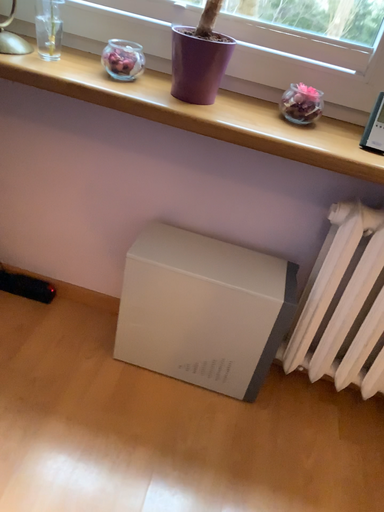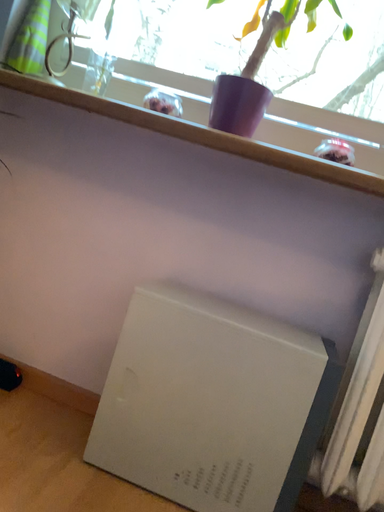
Question: Which way did the camera rotate in the video?

Choices:
 (A) rotated upward
 (B) rotated downward

Answer: (A)